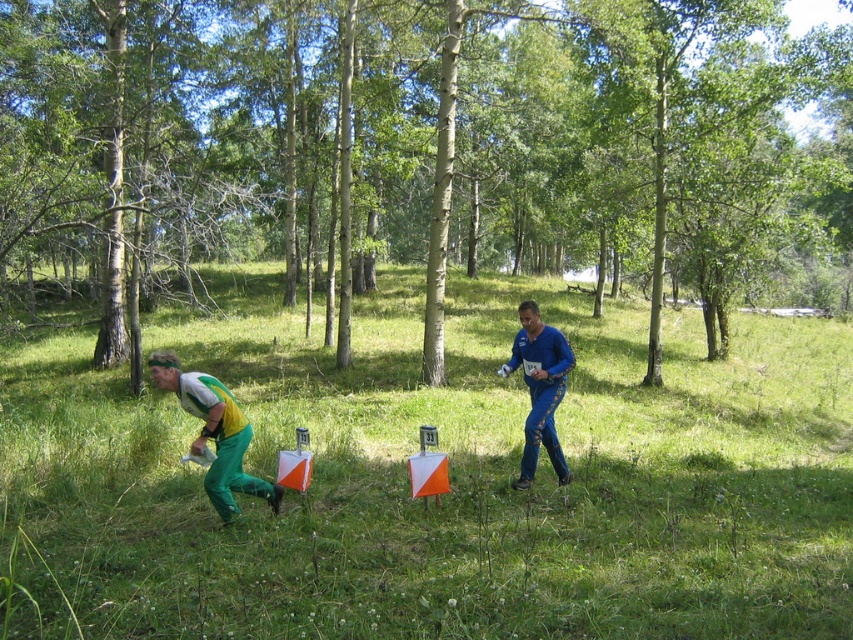
Question: Which object appears farthest from the camera in this image?

Choices:
 (A) blue textured pants at center
 (B) green grass at lower left

Answer: (A)

Question: Which object is the farthest from the brown bark tree at center?

Choices:
 (A) green grass at lower left
 (B) green fabric pants at lower left
 (C) blue textured pants at center

Answer: (C)

Question: Which point is farther to the camera?

Choices:
 (A) (231, 401)
 (B) (531, 353)
 (C) (793, 397)
 (D) (543, 92)

Answer: (D)

Question: Is brown bark tree at center wider than blue textured pants at center?

Choices:
 (A) yes
 (B) no

Answer: (A)

Question: In this image, where is brown bark tree at center located relative to green fabric pants at lower left?

Choices:
 (A) below
 (B) above

Answer: (B)

Question: Can you confirm if green grass at lower left is positioned to the right of blue textured pants at center?

Choices:
 (A) yes
 (B) no

Answer: (A)